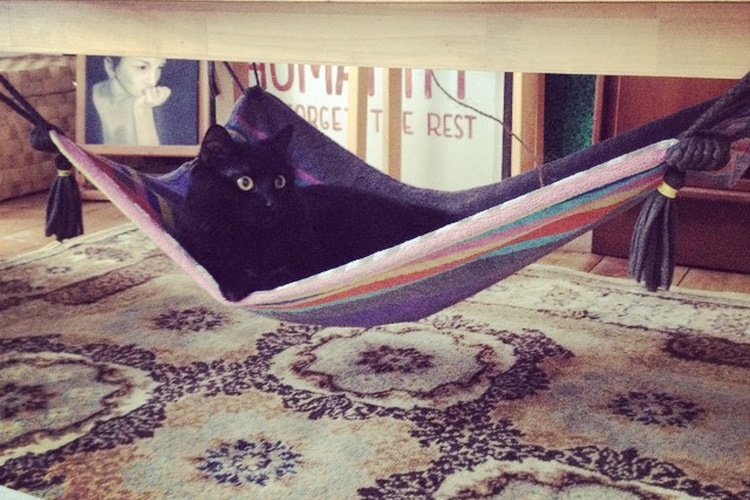
Identify the location of floor. (28, 234).